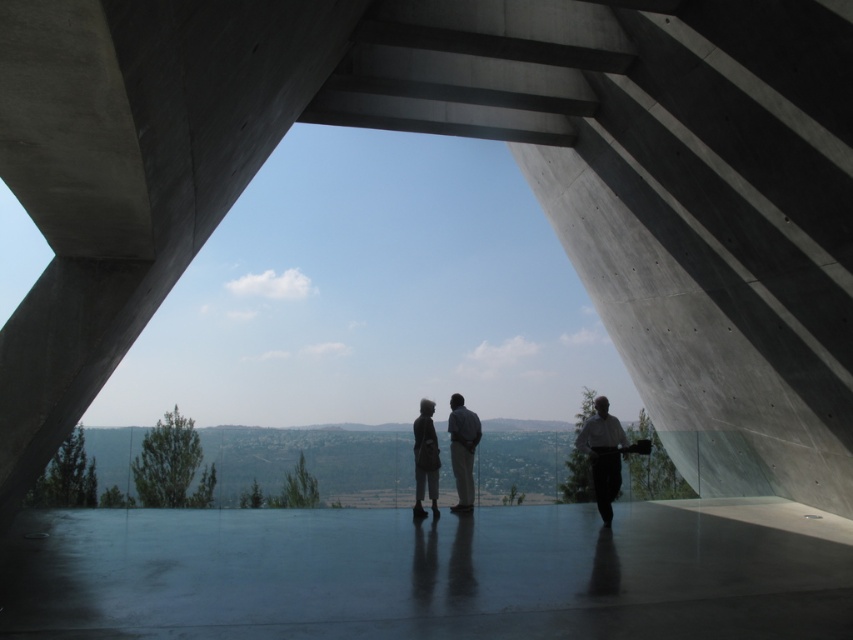
You are a visitor at the pavilion and you see the dark gray suit at center and the dark gray fabric bag at center. Which one is taller?

The dark gray suit at center is much taller than the dark gray fabric bag at center.

You are a security guard in the pavilion and need to check both the dark gray suit at center and the dark gray fabric bag at center. How far apart are these two items from each other?

The dark gray suit at center and the dark gray fabric bag at center are 48.02 centimeters apart.